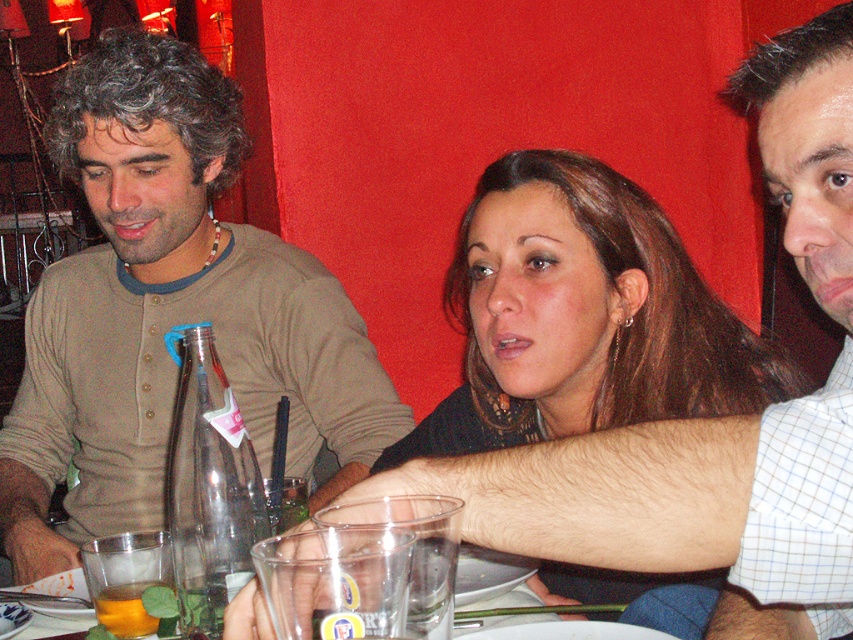
You are sitting at the table and want to pass a napkin to the person with the matte brown shirt at left and the smooth brown hair at center. Which one is closer to you so you can hand it directly?

The matte brown shirt at left is closer to you than the smooth brown hair at center, so you can hand it directly to the person with the matte brown shirt at left first.